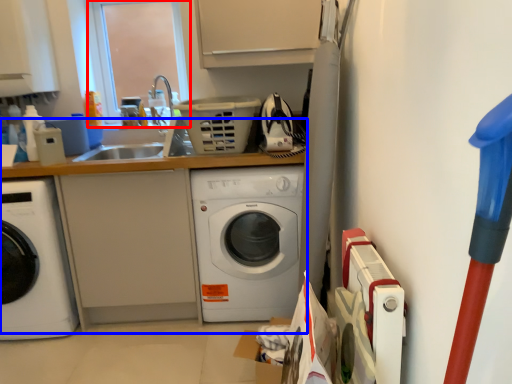
Question: Which point is further to the camera, window screen (highlighted by a red box) or counter top (highlighted by a blue box)?

Choices:
 (A) window screen
 (B) counter top

Answer: (A)